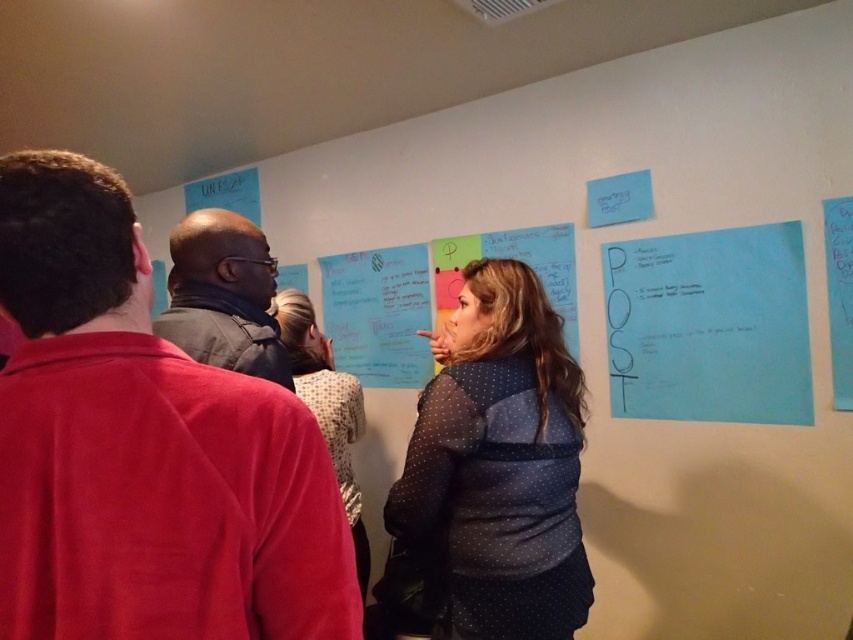
Can you confirm if blue paper at center is wider than white paper at upper center?

In fact, blue paper at center might be narrower than white paper at upper center.

Is blue paper at center to the left of white paper at upper center from the viewer's perspective?

Incorrect, blue paper at center is not on the left side of white paper at upper center.

Where is `blue paper at center`? The width and height of the screenshot is (853, 640). blue paper at center is located at coordinates (379, 314).

Locate an element on the screen. blue paper at center is located at coordinates (379, 314).

Between polka dot fabric jacket at center and white paper at upper center, which one appears on the left side from the viewer's perspective?

white paper at upper center is more to the left.

In the scene shown: Can you confirm if polka dot fabric jacket at center is wider than white paper at upper center?

Incorrect, polka dot fabric jacket at center's width does not surpass white paper at upper center's.

Locate an element on the screen. This screenshot has width=853, height=640. polka dot fabric jacket at center is located at coordinates (498, 465).

Identify the location of polka dot fabric jacket at center. (498, 465).

Who is more forward, (228, 257) or (344, 440)?

Point (228, 257)

Which of these two, dark gray sweater at center or polka dot fabric at center, stands shorter?

dark gray sweater at center

Is point (227, 225) closer to viewer compared to point (312, 364)?

Yes, point (227, 225) is in front of point (312, 364).

Identify the location of dark gray sweater at center. The image size is (853, 640). (223, 296).